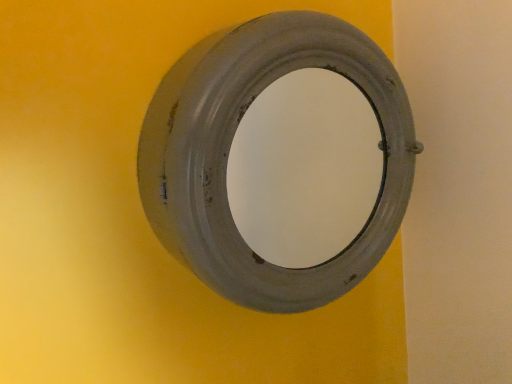
What do you see at coordinates (231, 143) in the screenshot? Image resolution: width=512 pixels, height=384 pixels. I see `gray metallic ring at center` at bounding box center [231, 143].

You are a GUI agent. You are given a task and a screenshot of the screen. Output one action in this format:
    pyautogui.click(x=<x>, y=<y>)
    Task: Click on the gray metallic ring at center
    This screenshot has width=512, height=384.
    Given the screenshot: What is the action you would take?
    pyautogui.click(x=231, y=143)

This screenshot has width=512, height=384. I want to click on gray metallic ring at center, so click(x=231, y=143).